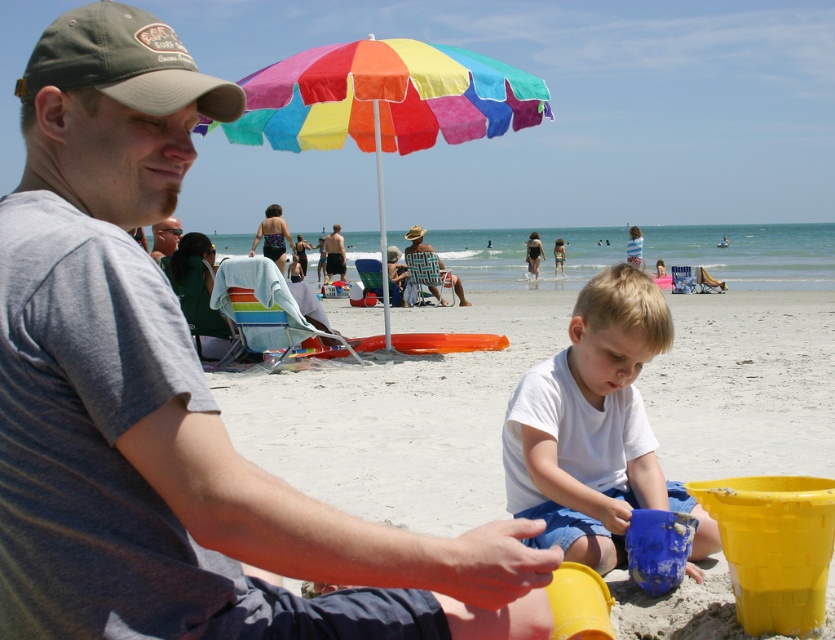
Question: Is gray cotton shirt at upper left positioned before matte black shorts at center?

Choices:
 (A) yes
 (B) no

Answer: (A)

Question: Which of the following is the closest to the observer?

Choices:
 (A) (419, 236)
 (B) (266, 228)
 (C) (67, 563)

Answer: (C)

Question: Which point is closer to the camera?

Choices:
 (A) white sand at center
 (B) matte black sunglasses at upper left
 (C) rainbow fabric umbrella at upper center
 (D) white matte shirt at center

Answer: (B)

Question: Does white sand at center have a greater width compared to matte black shorts at center?

Choices:
 (A) yes
 (B) no

Answer: (A)

Question: Is white sand at center to the left of matte black sunglasses at upper left from the viewer's perspective?

Choices:
 (A) no
 (B) yes

Answer: (A)

Question: Which point is farther to the camera?

Choices:
 (A) (257, 237)
 (B) (337, 260)
 (C) (382, 99)

Answer: (B)